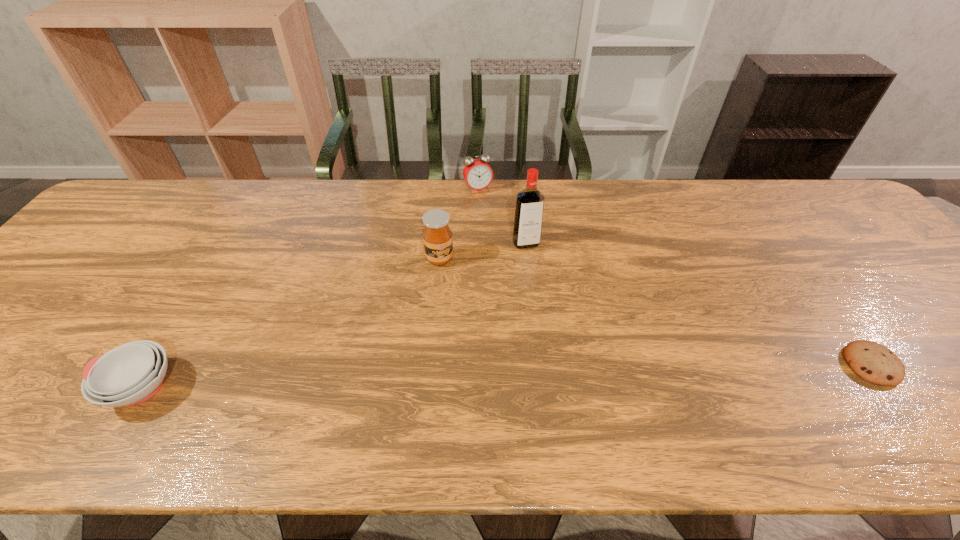
Where is `free space on the desktop that is between the leftmost object and the shortest object and is positioned on the front and back of the vodka`? free space on the desktop that is between the leftmost object and the shortest object and is positioned on the front and back of the vodka is located at coordinates (575, 374).

The image size is (960, 540). Identify the location of vacant space on the desktop that is between the leftmost object and the cookie and is positioned on the front-facing side of the third shortest object. (570, 374).

Where is `vacant spot on the desktop that is between the leftmost object and the shortest object and is positioned on the front-facing side of the honey`? The width and height of the screenshot is (960, 540). vacant spot on the desktop that is between the leftmost object and the shortest object and is positioned on the front-facing side of the honey is located at coordinates (512, 375).